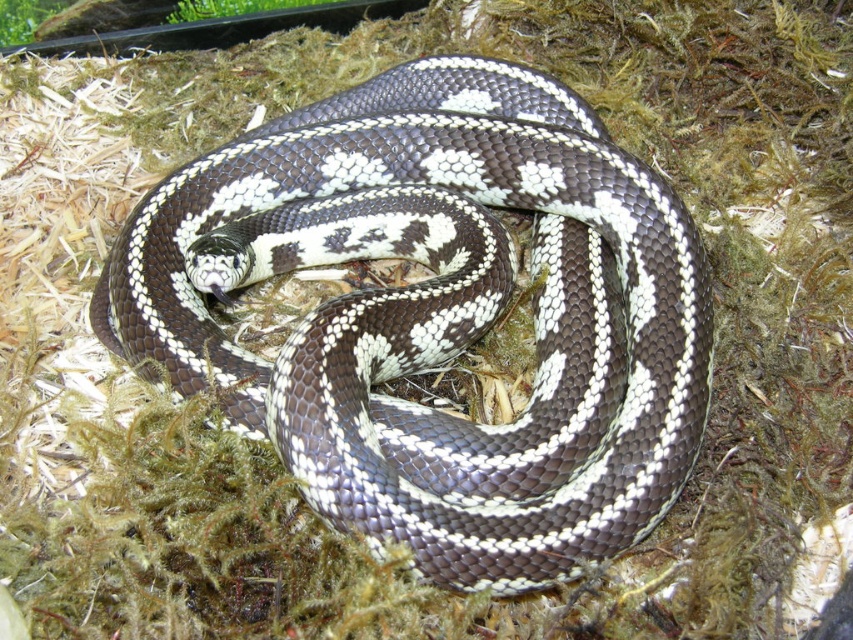
Question: Which is nearer to the green mossy grass at upper left?

Choices:
 (A) green mossy grass at upper center
 (B) shiny brown snake at center

Answer: (A)

Question: Which object appears farthest from the camera in this image?

Choices:
 (A) green mossy grass at upper center
 (B) green mossy grass at upper left
 (C) shiny brown snake at center

Answer: (A)

Question: Does shiny brown snake at center come in front of green mossy grass at upper left?

Choices:
 (A) yes
 (B) no

Answer: (A)

Question: Is green mossy grass at upper center below green mossy grass at upper left?

Choices:
 (A) yes
 (B) no

Answer: (B)

Question: Which point is farther to the camera?

Choices:
 (A) (479, 330)
 (B) (20, 3)

Answer: (B)

Question: Is shiny brown snake at center positioned before green mossy grass at upper center?

Choices:
 (A) yes
 (B) no

Answer: (A)